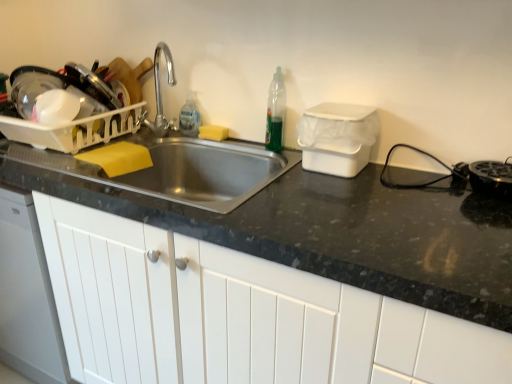
Find the location of a particular element. The height and width of the screenshot is (384, 512). vacant area that is in front of white plastic container at upper right, arranged as the 2th appliance when viewed from the right is located at coordinates (343, 197).